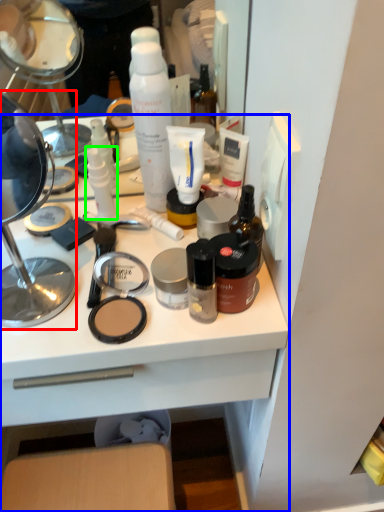
Question: Which object is the farthest from magnifying glass (highlighted by a red box)? Choose among these: desk (highlighted by a blue box) or toiletry (highlighted by a green box).

Choices:
 (A) desk
 (B) toiletry

Answer: (A)